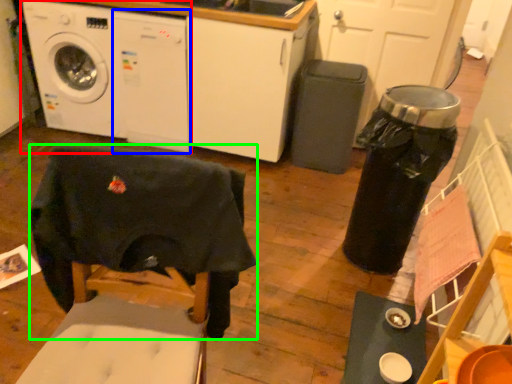
Question: Considering the real-world distances, which object is closest to washing machine (highlighted by a red box)? washing machine (highlighted by a blue box) or swivel chair (highlighted by a green box).

Choices:
 (A) washing machine
 (B) swivel chair

Answer: (A)